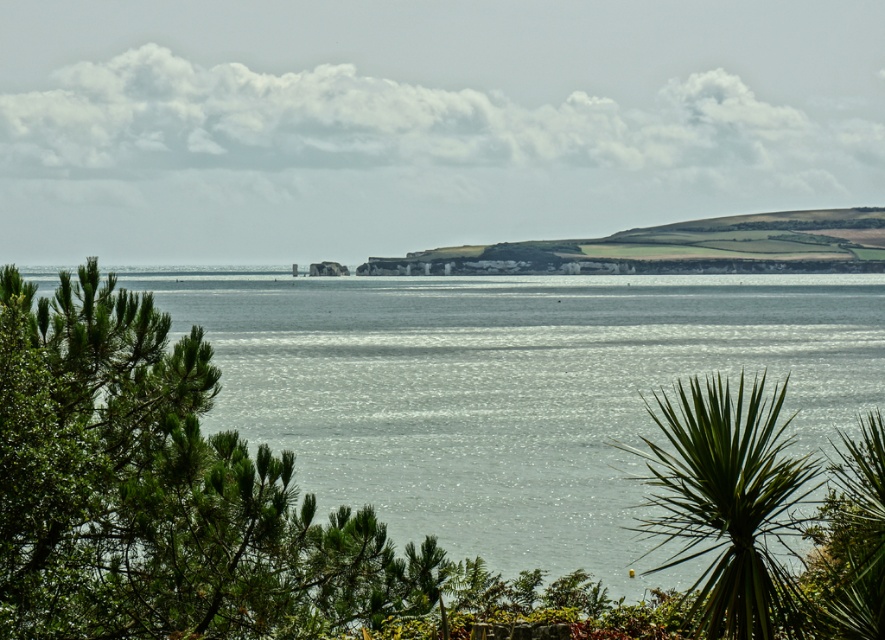
You are standing at the edge of the water in the coastal landscape shown. You want to locate the clear water at center. According to the coordinates provided, in which direction should you look relative to your position?

The clear water at center is located at coordinates point (509,388), which means you should look towards the center of the image to find it.